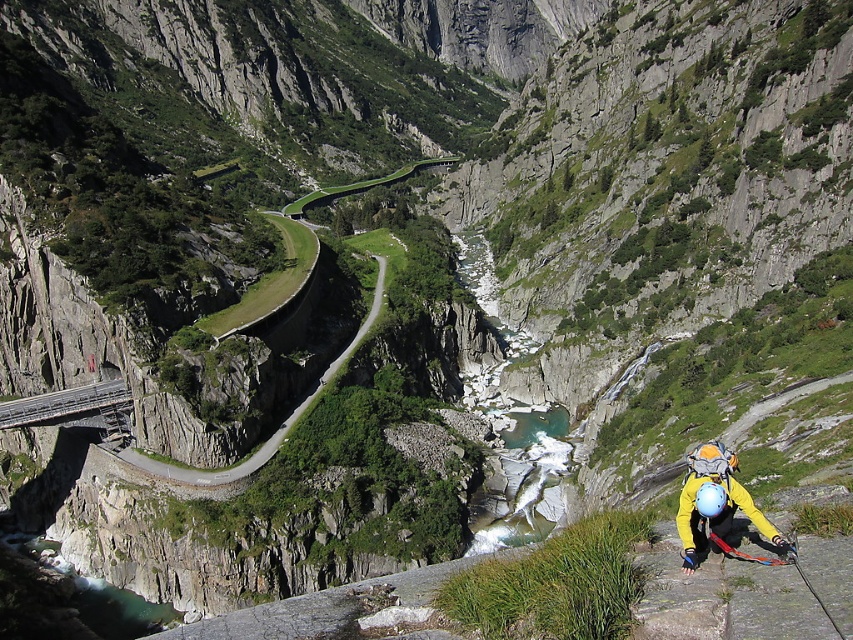
Is point (711, 499) more distant than point (85, 401)?

No.

Describe the element at coordinates (714, 502) in the screenshot. The width and height of the screenshot is (853, 640). I see `yellow fabric helmet at lower right` at that location.

Where is `yellow fabric helmet at lower right`? Image resolution: width=853 pixels, height=640 pixels. yellow fabric helmet at lower right is located at coordinates pos(714,502).

Which of these two, yellow fabric helmet at lower right or green asphalt road at center, stands shorter?

With less height is yellow fabric helmet at lower right.

In the scene shown: Between yellow fabric helmet at lower right and green asphalt road at center, which one is positioned lower?

yellow fabric helmet at lower right is lower down.

This screenshot has width=853, height=640. What do you see at coordinates (714, 502) in the screenshot?
I see `yellow fabric helmet at lower right` at bounding box center [714, 502].

In order to click on yellow fabric helmet at lower right in this screenshot , I will do `click(714, 502)`.

Find the location of a particular element. green asphalt road at center is located at coordinates (276, 429).

Does green asphalt road at center appear under metallic gray bridge at lower left?

Actually, green asphalt road at center is above metallic gray bridge at lower left.

Locate an element on the screen. green asphalt road at center is located at coordinates (276, 429).